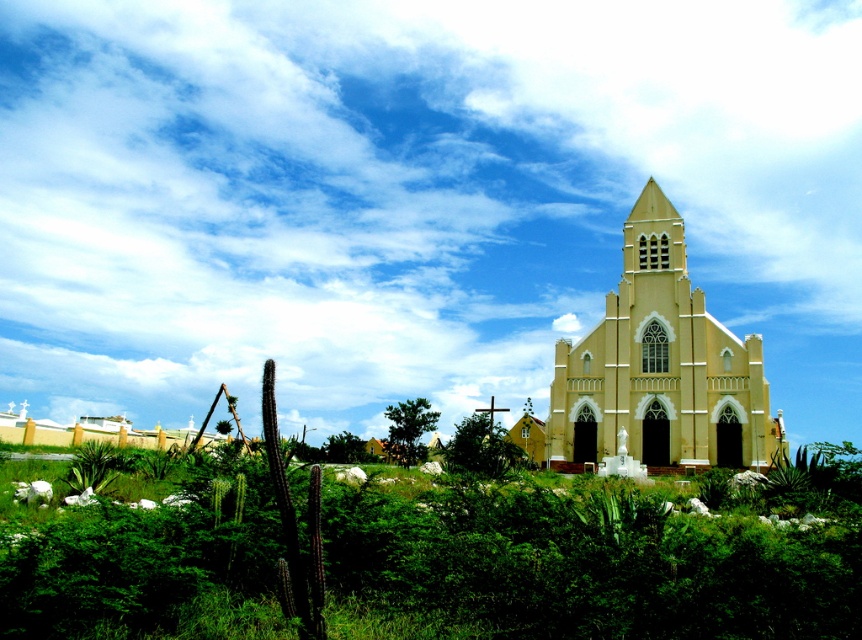
Question: Estimate the real-world distances between objects in this image. Which object is closer to the green leafy shrubs at center?

Choices:
 (A) yellow matte church at center
 (B) white fluffy cloud at upper center
 (C) green leafy bush at center

Answer: (C)

Question: Is green leafy shrubs at center further to the viewer compared to green leafy bush at center?

Choices:
 (A) no
 (B) yes

Answer: (A)

Question: Estimate the real-world distances between objects in this image. Which object is farther from the white fluffy cloud at upper center?

Choices:
 (A) green leafy bush at center
 (B) green leafy shrubs at center

Answer: (B)

Question: Considering the relative positions of green leafy shrubs at center and green leafy bush at center in the image provided, where is green leafy shrubs at center located with respect to green leafy bush at center?

Choices:
 (A) right
 (B) left

Answer: (A)

Question: Where is yellow matte church at center located in relation to green leafy bush at center in the image?

Choices:
 (A) right
 (B) left

Answer: (A)

Question: Which point is farther to the camera?

Choices:
 (A) coord(411,433)
 (B) coord(205,458)
 (C) coord(744,420)
 (D) coord(401,243)

Answer: (D)